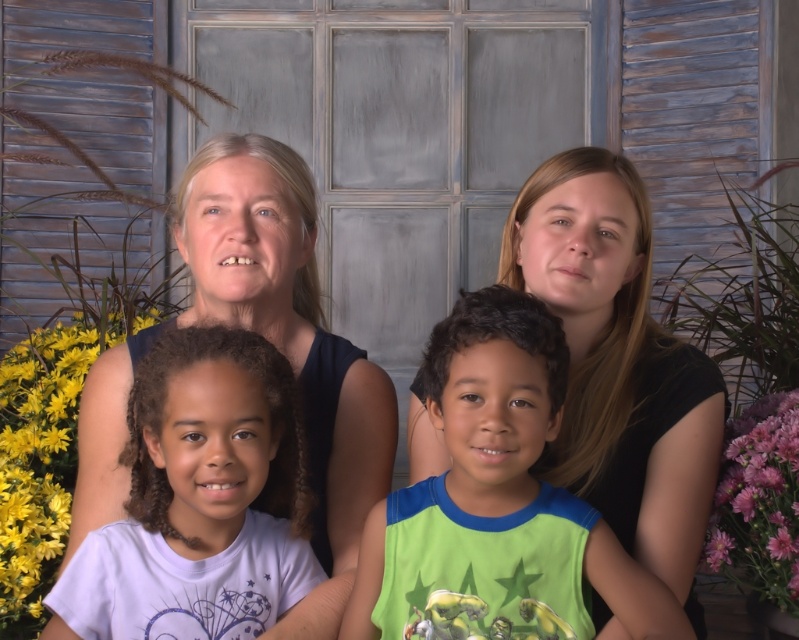
Question: From the image, what is the correct spatial relationship of white matte shirt at lower left in relation to purple matte flower at lower right?

Choices:
 (A) right
 (B) left

Answer: (B)

Question: Which object appears closest to the camera in this image?

Choices:
 (A) smooth skin family at center
 (B) white matte shirt at lower left
 (C) yellow matte flower at lower left
 (D) green fabric shirt at center

Answer: (D)

Question: Considering the relative positions of smooth skin family at center and purple matte flower at lower right in the image provided, where is smooth skin family at center located with respect to purple matte flower at lower right?

Choices:
 (A) below
 (B) above

Answer: (B)

Question: Observing the image, what is the correct spatial positioning of smooth skin family at center in reference to purple silky flower at right?

Choices:
 (A) below
 (B) above

Answer: (B)

Question: Which of the following is the farthest from the observer?

Choices:
 (A) (718, 540)
 (B) (587, 531)
 (C) (646, 321)

Answer: (A)

Question: Which object is the closest to the green fabric shirt at center?

Choices:
 (A) purple matte flower at lower right
 (B) yellow matte flower at lower left
 (C) purple silky flower at right
 (D) smooth skin family at center

Answer: (D)